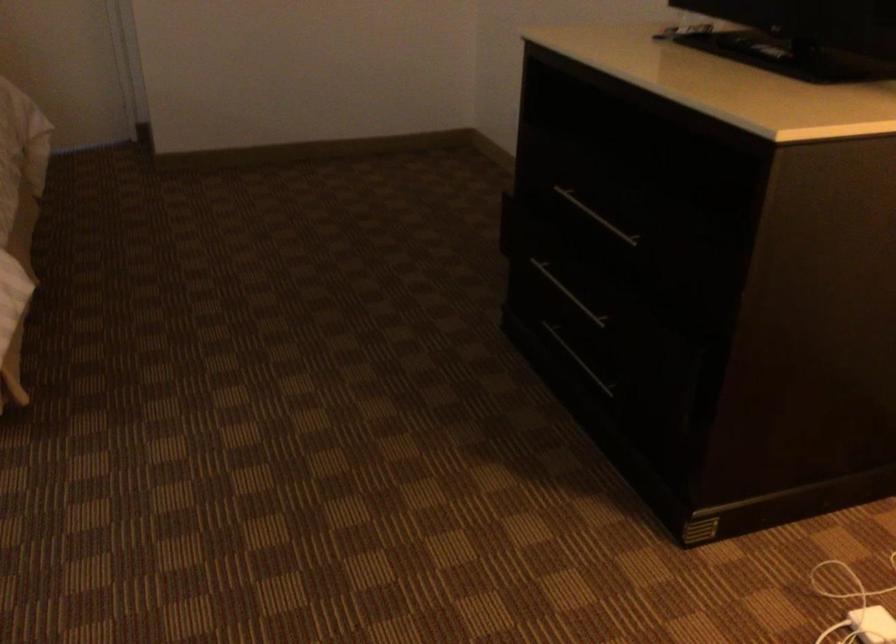
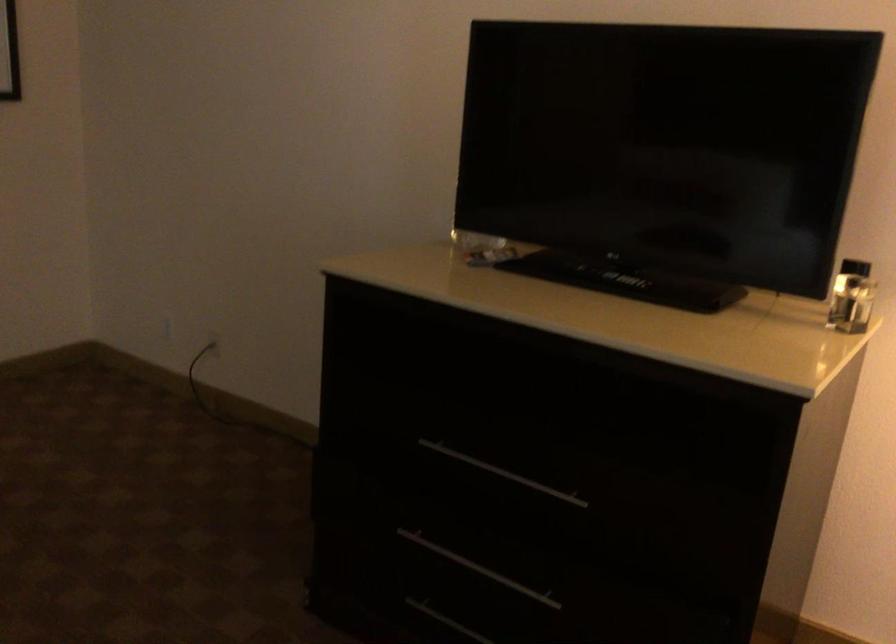
Locate, in the second image, the point that corresponds to point (597, 214) in the first image.

(502, 473)